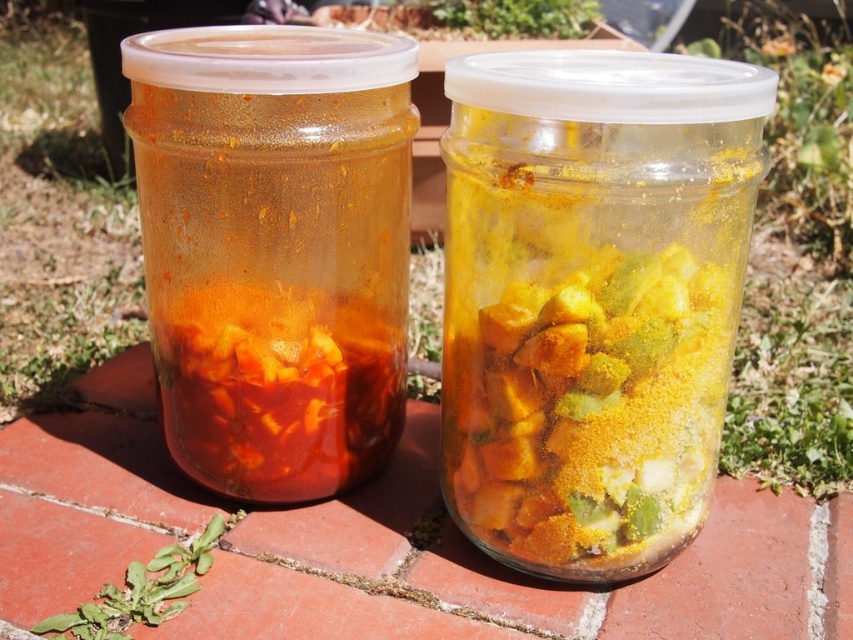
Between yellow translucent jar at center and translucent glass jar at left, which one appears on the left side from the viewer's perspective?

translucent glass jar at left

Is yellow translucent jar at center shorter than translucent glass jar at left?

Indeed, yellow translucent jar at center has a lesser height compared to translucent glass jar at left.

Where is `yellow translucent jar at center`? This screenshot has height=640, width=853. yellow translucent jar at center is located at coordinates (592, 298).